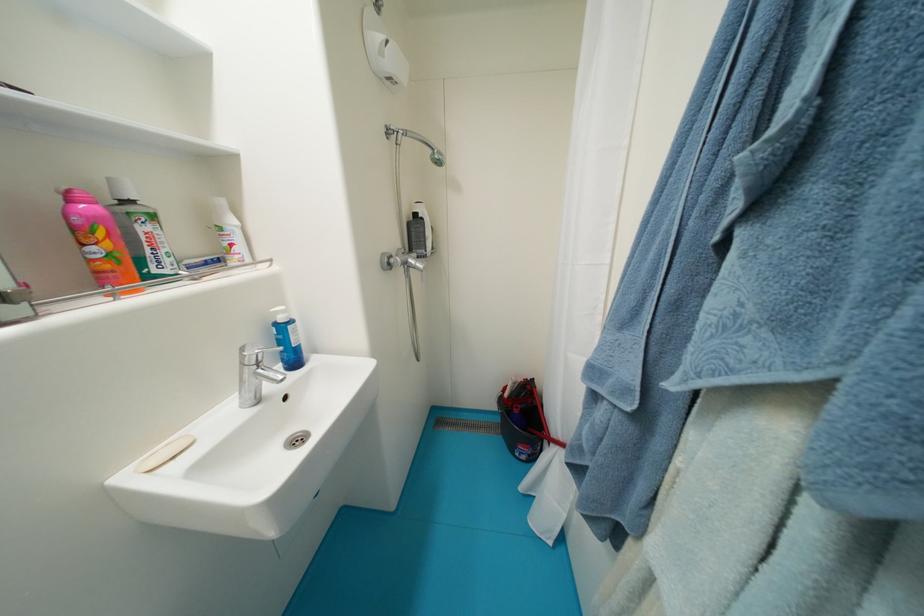
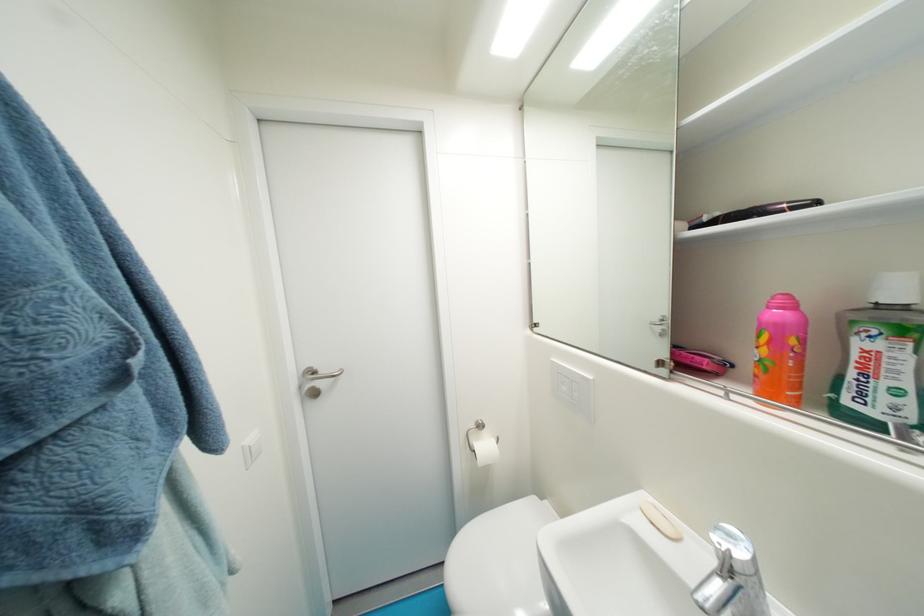
Find the pixel in the second image that matches point 154,252 in the first image.

(858, 376)